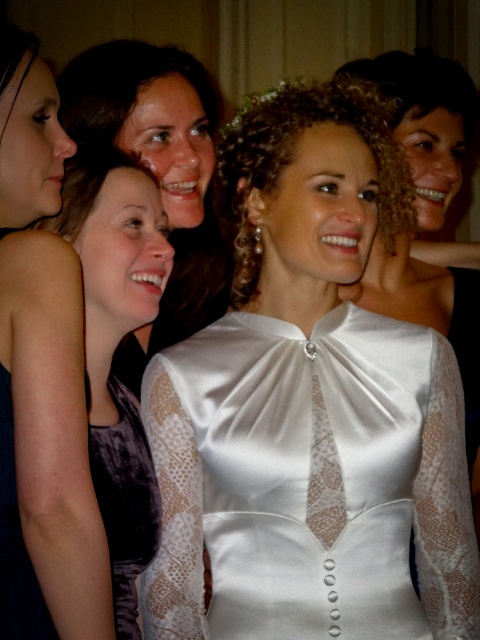
Who is lower down, satin white dress at center or matte purple dress at center?

satin white dress at center

I want to click on satin white dress at center, so (x=310, y=483).

Image resolution: width=480 pixels, height=640 pixels. Find the location of `satin white dress at center`. satin white dress at center is located at coordinates (310, 483).

Who is lower down, matte black dress at left or velvet purple dress at lower left?

velvet purple dress at lower left is lower down.

Identify the location of matte black dress at left. This screenshot has width=480, height=640. (47, 353).

Can you confirm if satin white dress at center is positioned below matte black dress at left?

Correct, satin white dress at center is located below matte black dress at left.

Does point (464, 509) come behind point (33, 237)?

That is True.

Between point (384, 584) and point (10, 192), which one is positioned in front?

Positioned in front is point (10, 192).

This screenshot has height=640, width=480. What are the coordinates of `satin white dress at center` in the screenshot? It's located at (310, 483).